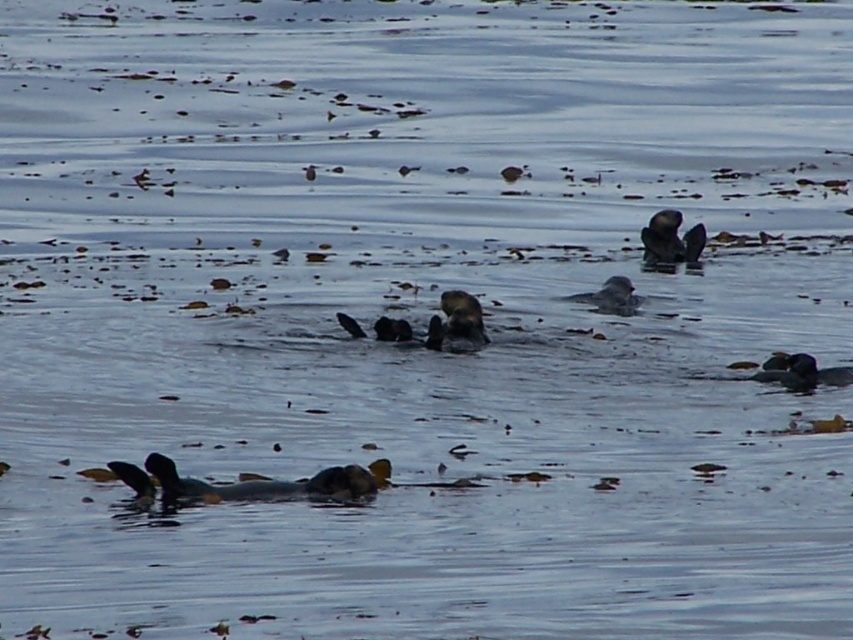
Question: Which of the following is the farthest from the observer?

Choices:
 (A) (618, 305)
 (B) (686, 240)
 (C) (483, 342)

Answer: (B)

Question: Which object appears closest to the camera in this image?

Choices:
 (A) dark brown feathers at lower right
 (B) dark gray fur duck at lower left

Answer: (B)

Question: Does dark brown fuzzy duck at upper right appear under dark brown feathers at lower right?

Choices:
 (A) yes
 (B) no

Answer: (B)

Question: Is dark gray fur duck at lower left smaller than gray matte duck at center?

Choices:
 (A) yes
 (B) no

Answer: (B)

Question: In this image, where is dark gray fur duck at lower left located relative to gray matte duck at center?

Choices:
 (A) right
 (B) left

Answer: (B)

Question: Among these points, which one is nearest to the camera?

Choices:
 (A) (664, 228)
 (B) (807, 355)
 (C) (462, 316)
 (D) (613, 298)

Answer: (B)